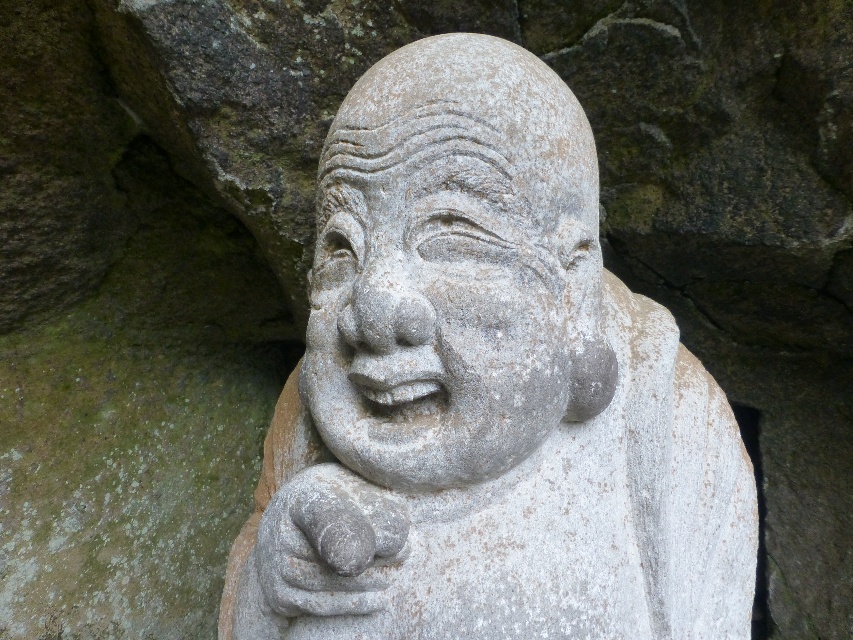
Question: Considering the relative positions of white stone statue at center and gray stone statue at center in the image provided, where is white stone statue at center located with respect to gray stone statue at center?

Choices:
 (A) right
 (B) left

Answer: (B)

Question: Which point is closer to the camera?

Choices:
 (A) (525, 300)
 (B) (392, 156)

Answer: (A)

Question: Is white stone statue at center wider than gray stone statue at center?

Choices:
 (A) no
 (B) yes

Answer: (B)

Question: Can you confirm if white stone statue at center is positioned to the left of gray stone statue at center?

Choices:
 (A) yes
 (B) no

Answer: (A)

Question: Which point appears closest to the camera in this image?

Choices:
 (A) (527, 426)
 (B) (502, 424)

Answer: (B)